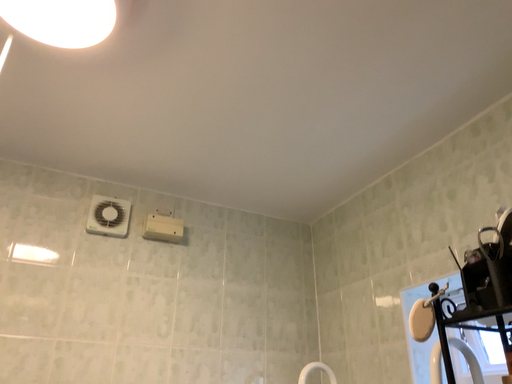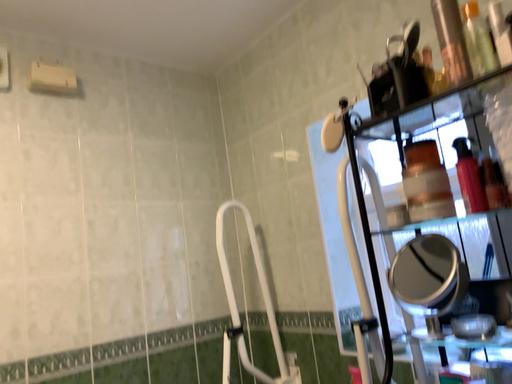
Question: Which way did the camera rotate in the video?

Choices:
 (A) rotated upward
 (B) rotated downward

Answer: (B)